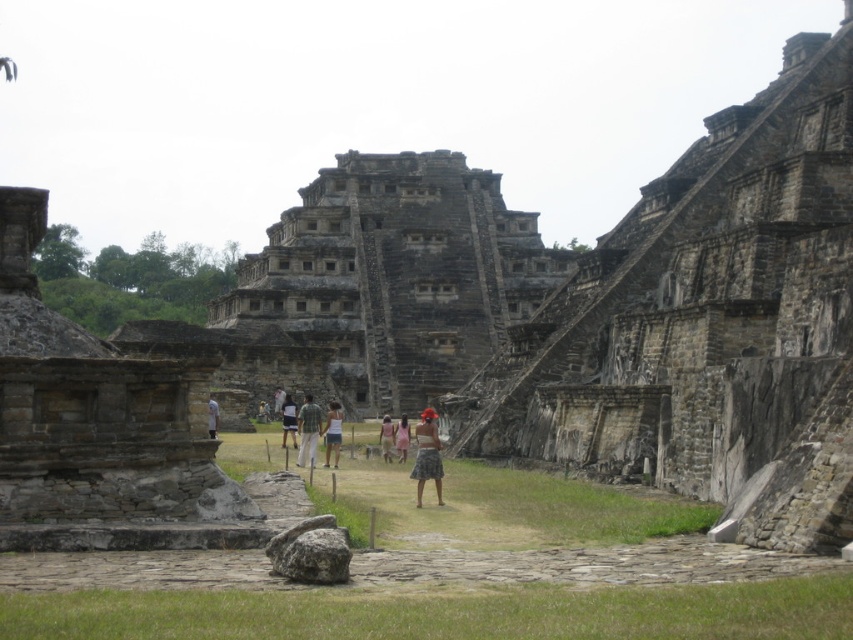
You are an archaeologist examining the ancient structures and noticing two clothing items in the scene. Which clothing item is positioned more to the east? The plaid skirt at center or the green plaid shirt at center?

The plaid skirt at center is to the right of green plaid shirt at center. Since the scene is viewed from a standard perspective where right corresponds to east, the plaid skirt at center is positioned more to the east.

You are an archaeologist standing at the base of the ancient pyramid. You notice both the dark gray stone ruins at center and the pink fabric skirt at center. Which object is wider from your perspective?

The dark gray stone ruins at center might be wider than the pink fabric skirt at center according to the description.

You are an archaeologist examining the ancient structures and noticing two clothing items in the foreground. Which clothing item is taller between the plaid skirt at center and the green plaid shirt at center?

The plaid skirt at center is much taller than the green plaid shirt at center.